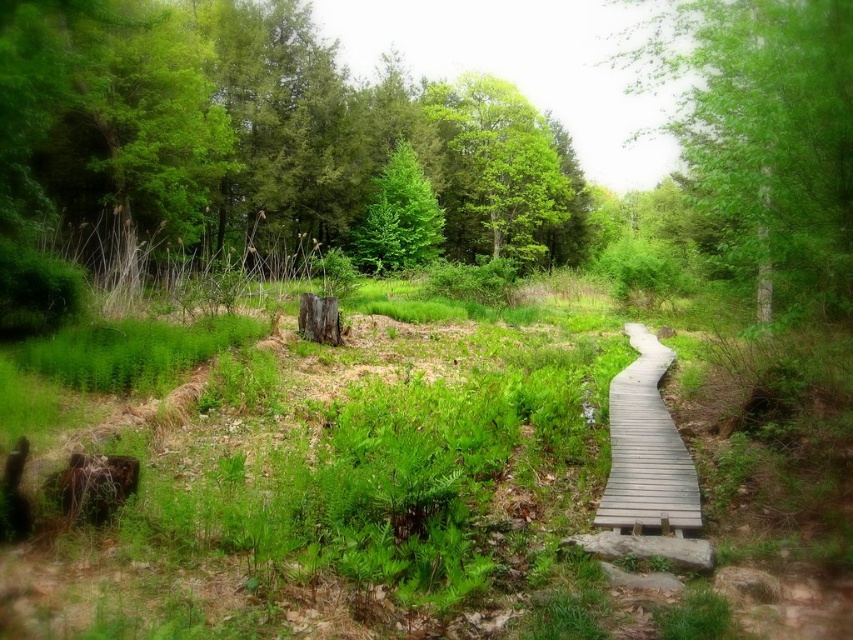
Which is in front, point (699, 20) or point (395, 218)?

Point (699, 20) is in front.

Does point (836, 225) lie behind point (428, 192)?

That is False.

This screenshot has height=640, width=853. In order to click on green leafy tree at upper right in this screenshot , I will do click(764, 129).

Is point (849, 611) less distant than point (610, 444)?

Yes, point (849, 611) is in front of point (610, 444).

Can you confirm if green grass at center is wider than gray wooden boardwalk at center-right?

Yes, green grass at center is wider than gray wooden boardwalk at center-right.

Is point (350, 403) closer to camera compared to point (689, 481)?

No.

This screenshot has height=640, width=853. What are the coordinates of `green grass at center` in the screenshot? It's located at (337, 486).

You are a GUI agent. You are given a task and a screenshot of the screen. Output one action in this format:
    pyautogui.click(x=<x>, y=<y>)
    Task: Click on the green grass at center
    
    Given the screenshot: What is the action you would take?
    pyautogui.click(x=337, y=486)

Is green grass at center wider than green matte tree at center?

Indeed, green grass at center has a greater width compared to green matte tree at center.

Is point (357, 428) positioned before point (439, 205)?

Yes, point (357, 428) is in front of point (439, 205).

Identify the location of green grass at center. This screenshot has width=853, height=640. (337, 486).